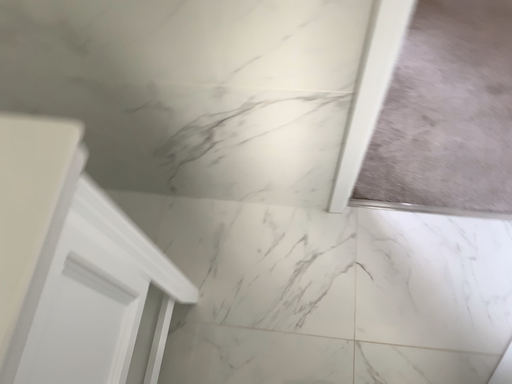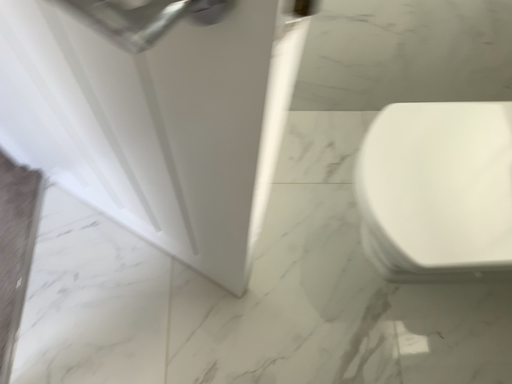
Question: Which way did the camera rotate in the video?

Choices:
 (A) rotated upward
 (B) rotated downward

Answer: (A)